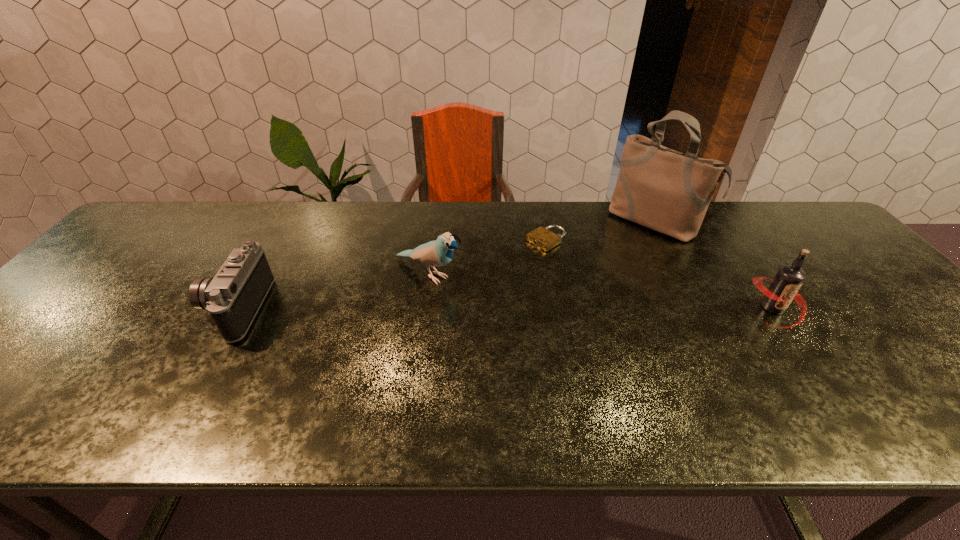
Where is `padlock situated at the far edge`? Image resolution: width=960 pixels, height=540 pixels. padlock situated at the far edge is located at coordinates (544, 239).

Locate an element on the screen. shoulder bag positioned at the far edge is located at coordinates (667, 191).

Where is `vacant region at the far edge`? vacant region at the far edge is located at coordinates (599, 219).

Identify the location of vacant space at the near edge of the desktop. (72, 370).

In the image, there is a desktop. Identify the location of vacant space at the left edge. Image resolution: width=960 pixels, height=540 pixels. (94, 296).

This screenshot has height=540, width=960. Find the location of `vacant region at the right edge of the desktop`. vacant region at the right edge of the desktop is located at coordinates (864, 267).

Image resolution: width=960 pixels, height=540 pixels. Find the location of `vacant space at the far left corner`. vacant space at the far left corner is located at coordinates (198, 203).

In the image, there is a desktop. At what (x,y) coordinates should I click in order to perform the action: click on vacant space at the near left corner. Please return your answer as a coordinate pair (x, y). The height and width of the screenshot is (540, 960). Looking at the image, I should click on (24, 369).

This screenshot has height=540, width=960. What are the coordinates of `free region at the far right corner` in the screenshot? It's located at (767, 212).

This screenshot has height=540, width=960. I want to click on vacant area at the near right corner of the desktop, so click(x=938, y=367).